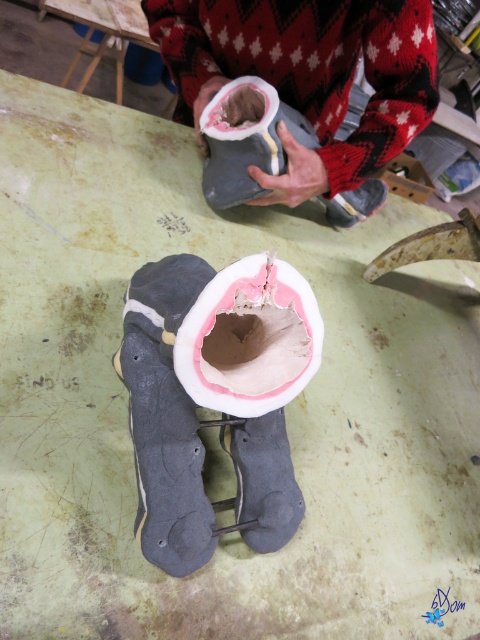
Question: Does green matte table at upper center appear over matte gray boot at center?

Choices:
 (A) yes
 (B) no

Answer: (A)

Question: Is pink clay paper plate at center positioned at the back of green matte table at upper center?

Choices:
 (A) yes
 (B) no

Answer: (B)

Question: Based on their relative distances, which object is nearer to the pink clay paper plate at center?

Choices:
 (A) matte gray boot at center
 (B) green matte table at upper center
 (C) matte gray boot at upper center

Answer: (C)

Question: Which object is the closest to the matte gray boot at center?

Choices:
 (A) pink clay paper plate at center
 (B) matte gray boot at upper center

Answer: (B)

Question: Can you confirm if matte gray boot at upper center is positioned to the right of green matte table at upper center?

Choices:
 (A) yes
 (B) no

Answer: (A)

Question: Which object appears farthest from the camera in this image?

Choices:
 (A) matte gray boot at center
 (B) green matte table at upper center
 (C) matte gray boot at upper center
 (D) pink clay paper plate at center

Answer: (B)